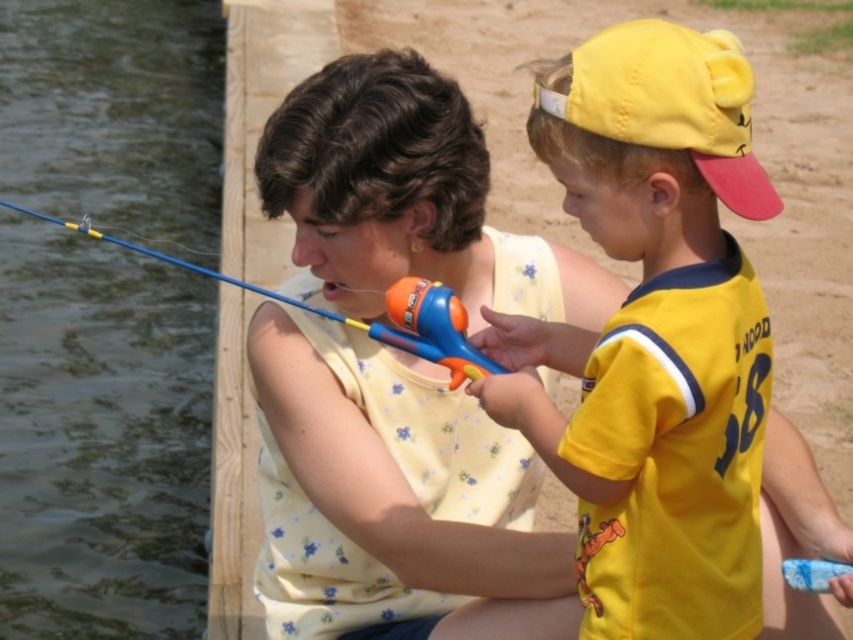
Who is lower down, yellow matte cap at upper right or blue plastic toy at lower right?

blue plastic toy at lower right is below.

Can you confirm if yellow matte cap at upper right is taller than blue plastic toy at lower right?

Yes, yellow matte cap at upper right is taller than blue plastic toy at lower right.

Locate an element on the screen. yellow matte cap at upper right is located at coordinates (654, 336).

What do you see at coordinates (654, 336) in the screenshot?
I see `yellow matte cap at upper right` at bounding box center [654, 336].

Does point (662, 28) come behind point (653, 28)?

Yes, point (662, 28) is behind point (653, 28).

Locate an element on the screen. yellow matte cap at upper right is located at coordinates (654, 336).

Does yellow fabric baseball cap at upper right have a lesser height compared to blue plastic toy at lower right?

Incorrect, yellow fabric baseball cap at upper right's height does not fall short of blue plastic toy at lower right's.

Who is positioned more to the right, yellow fabric baseball cap at upper right or blue plastic toy at lower right?

Positioned to the right is blue plastic toy at lower right.

Find the location of a particular element. This screenshot has width=853, height=640. yellow fabric baseball cap at upper right is located at coordinates (670, 102).

This screenshot has height=640, width=853. I want to click on yellow fabric baseball cap at upper right, so click(x=670, y=102).